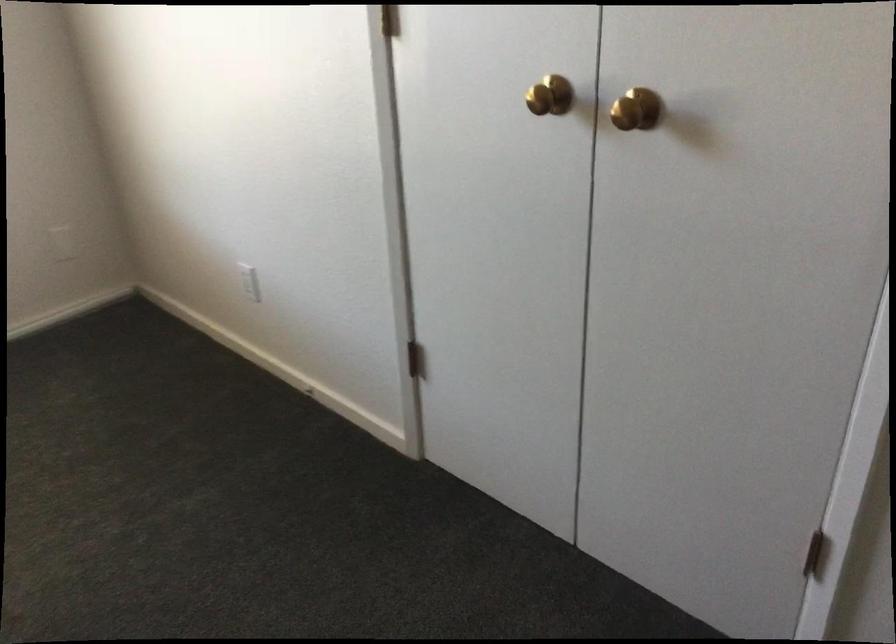
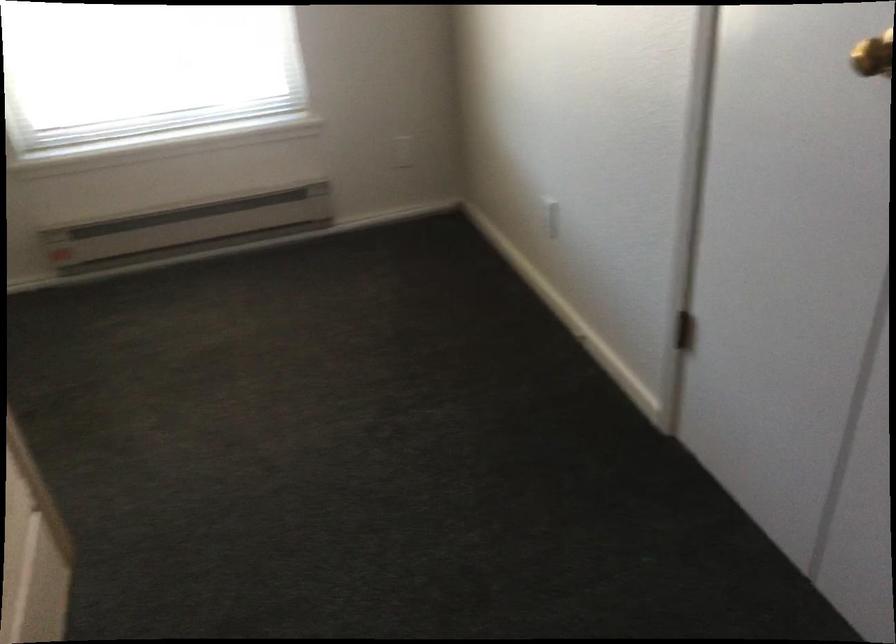
In the second image, find the point that corresponds to [252,283] in the first image.

(550, 216)